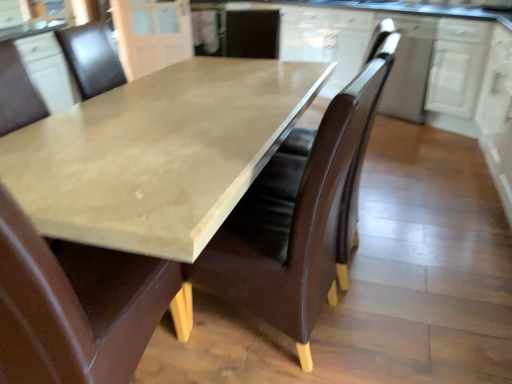
Question: Is matte brown leather chair at center, the second chair viewed from the right, not near brown leather swivel chair at center?

Choices:
 (A) yes
 (B) no

Answer: (B)

Question: From a real-world perspective, does matte brown leather chair at center, the second chair viewed from the right, stand above brown leather swivel chair at center?

Choices:
 (A) no
 (B) yes

Answer: (A)

Question: Can you confirm if matte brown leather chair at center, the second chair viewed from the right, is smaller than brown leather swivel chair at center?

Choices:
 (A) yes
 (B) no

Answer: (B)

Question: From the image's perspective, would you say matte brown leather chair at center, the second chair viewed from the right, is positioned over brown leather swivel chair at center?

Choices:
 (A) no
 (B) yes

Answer: (A)

Question: Considering the relative positions of matte brown leather chair at center, the second chair viewed from the right, and brown leather swivel chair at center in the image provided, is matte brown leather chair at center, the second chair viewed from the right, to the right of brown leather swivel chair at center from the viewer's perspective?

Choices:
 (A) no
 (B) yes

Answer: (A)

Question: Is white glossy cabinet at upper right, placed as the 2th cabinetry when sorted from left to right, inside or outside of white glossy cabinet at upper right, which is counted as the fourth cabinetry, starting from the left?

Choices:
 (A) inside
 (B) outside

Answer: (B)

Question: Considering the relative positions of white glossy cabinet at upper right, placed as the 2th cabinetry when sorted from left to right, and white glossy cabinet at upper right, which is counted as the fourth cabinetry, starting from the left, in the image provided, is white glossy cabinet at upper right, placed as the 2th cabinetry when sorted from left to right, to the left or to the right of white glossy cabinet at upper right, which is counted as the fourth cabinetry, starting from the left,?

Choices:
 (A) right
 (B) left

Answer: (B)

Question: Is point (412, 48) closer or farther from the camera than point (441, 46)?

Choices:
 (A) farther
 (B) closer

Answer: (A)

Question: In terms of width, does white glossy cabinet at upper right, the 3th cabinetry when ordered from right to left, look wider or thinner when compared to white glossy cabinet at upper right, which is counted as the fourth cabinetry, starting from the left?

Choices:
 (A) wide
 (B) thin

Answer: (A)

Question: In terms of width, does matte brown leather chair at center, the second chair viewed from the right, look wider or thinner when compared to matte brown leather chair at center, the first chair from the right?

Choices:
 (A) thin
 (B) wide

Answer: (B)

Question: Is matte brown leather chair at center, marked as the 1th chair in a left-to-right arrangement, in front of or behind matte brown leather chair at center, the 2th chair in the left-to-right sequence, in the image?

Choices:
 (A) front
 (B) behind

Answer: (A)

Question: Visually, is matte brown leather chair at center, the second chair viewed from the right, positioned to the left or to the right of matte brown leather chair at center, the 2th chair in the left-to-right sequence?

Choices:
 (A) left
 (B) right

Answer: (A)

Question: Is matte brown leather chair at center, marked as the 1th chair in a left-to-right arrangement, bigger or smaller than matte brown leather chair at center, the 2th chair in the left-to-right sequence?

Choices:
 (A) big
 (B) small

Answer: (B)

Question: Would you say white glossy cabinet at right, positioned as the third cabinetry in left-to-right order, is inside or outside brown leather swivel chair at center?

Choices:
 (A) outside
 (B) inside

Answer: (A)

Question: From the image's perspective, relative to brown leather swivel chair at center, is white glossy cabinet at right, positioned as the third cabinetry in left-to-right order, above or below?

Choices:
 (A) below
 (B) above

Answer: (B)